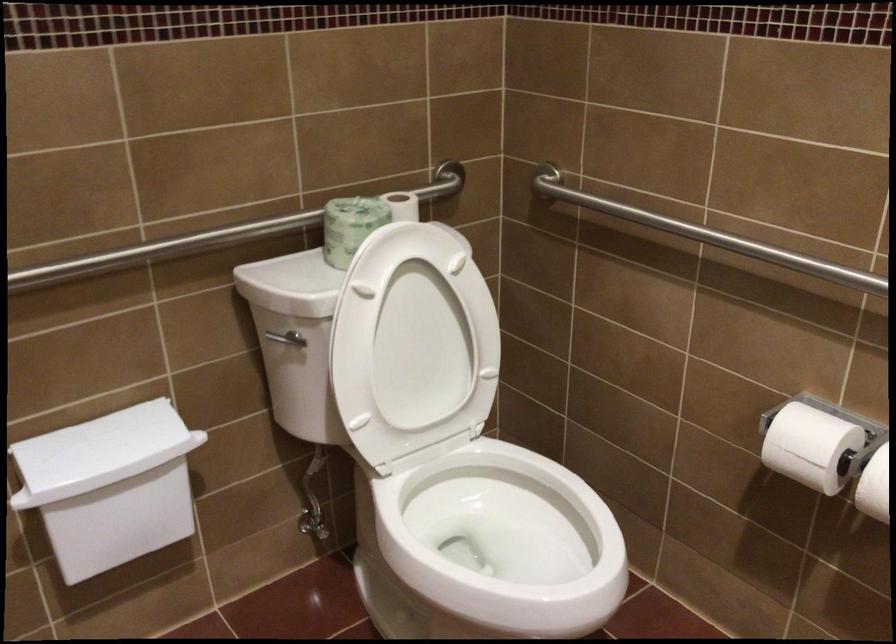
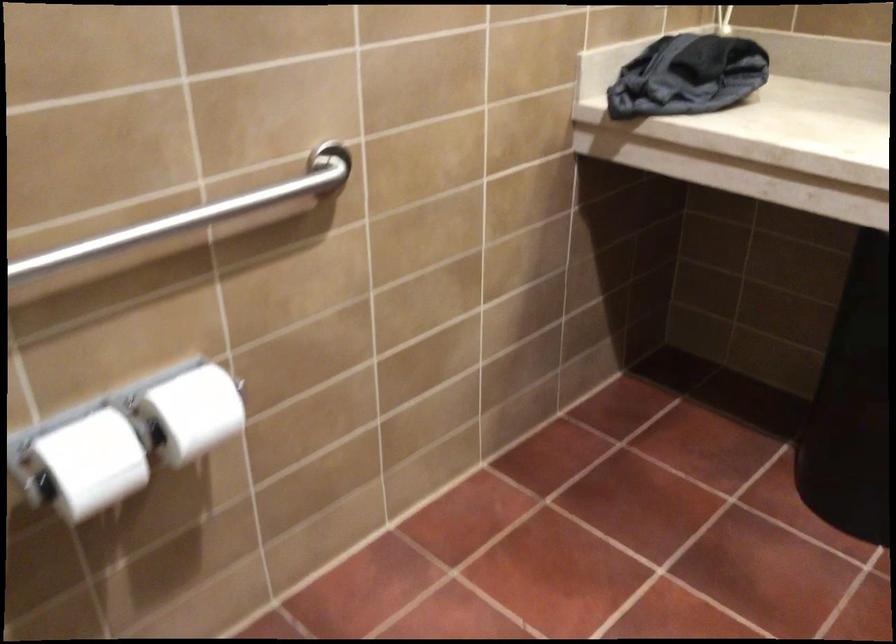
The first image is from the beginning of the video and the second image is from the end. How did the camera likely rotate when shooting the video?

The rotation direction of the camera is right-down.